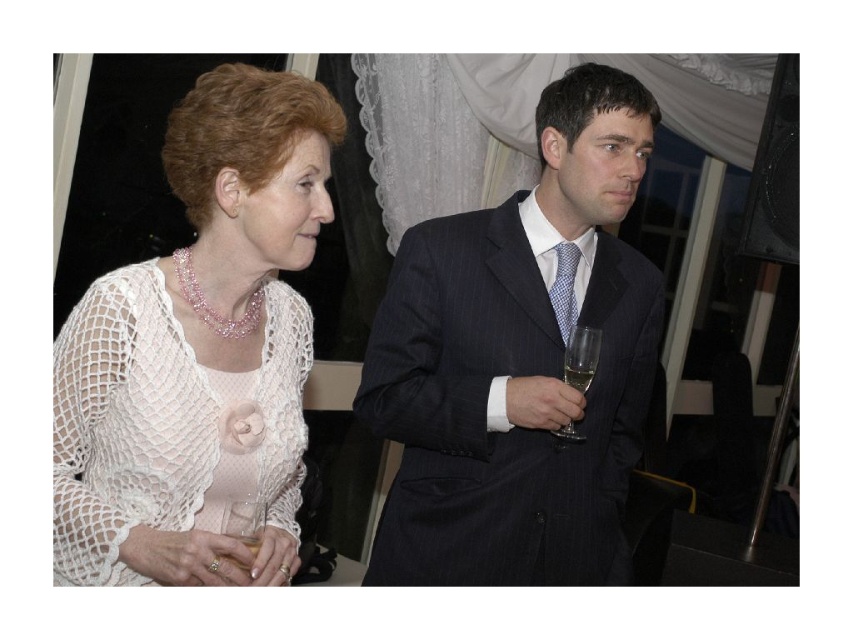
Who is shorter, matte glass at right or clear glass wine glass at right?

matte glass at right

Which is more to the left, matte glass at right or clear glass wine glass at right?

From the viewer's perspective, matte glass at right appears more on the left side.

Who is more forward, (552, 380) or (572, 374)?

Point (572, 374)

Identify the location of matte glass at right. (541, 403).

Is dark blue pinstripe suit at center shorter than matte glass at right?

In fact, dark blue pinstripe suit at center may be taller than matte glass at right.

This screenshot has height=640, width=853. What are the coordinates of `dark blue pinstripe suit at center` in the screenshot? It's located at (519, 360).

Between point (137, 292) and point (561, 440), which one is positioned in front?

Positioned in front is point (137, 292).

This screenshot has height=640, width=853. What do you see at coordinates (198, 352) in the screenshot? I see `white crochet sweater at left` at bounding box center [198, 352].

Find the location of a particular element. The image size is (853, 640). white crochet sweater at left is located at coordinates (198, 352).